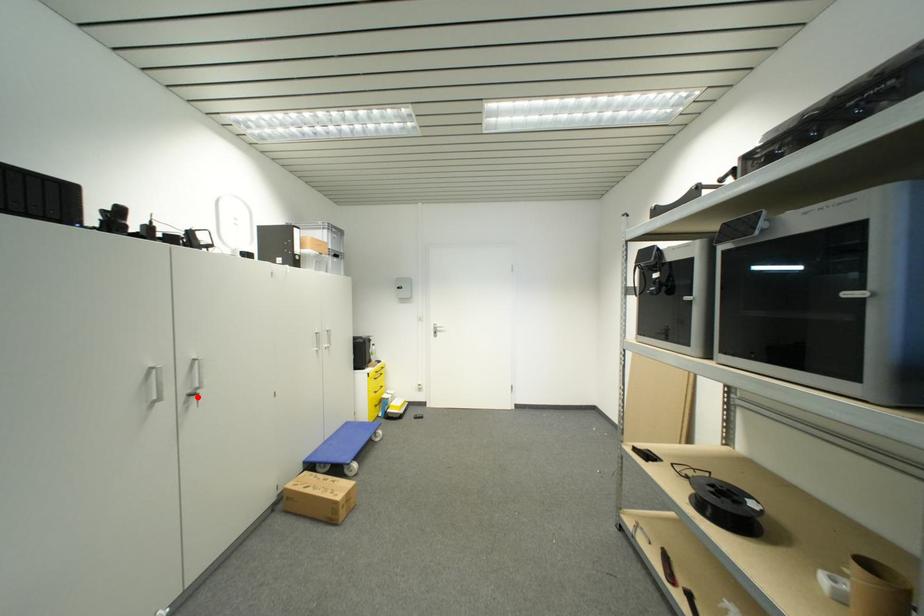
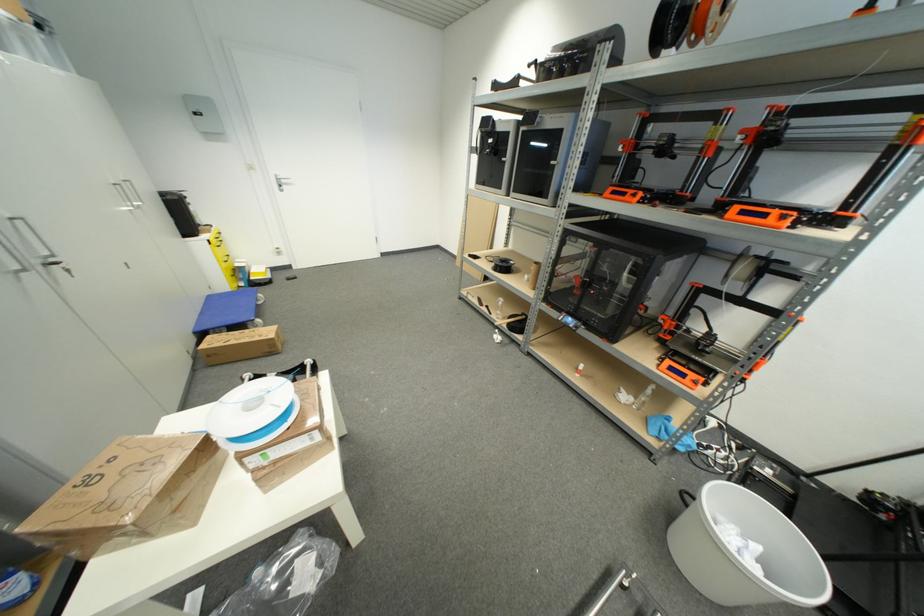
In the second image, find the point that corresponds to the highlighted location in the first image.

(59, 265)